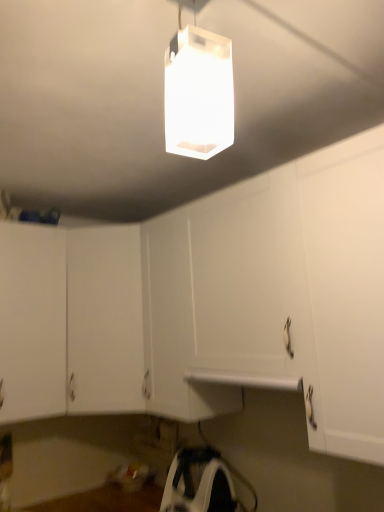
Question: Does white matte cabinet at center, which is the 1th cabinetry from right to left, have a smaller size compared to transparent plastic lamp at upper center?

Choices:
 (A) yes
 (B) no

Answer: (B)

Question: Are white matte cabinet at center, which is the 1th cabinetry from right to left, and transparent plastic lamp at upper center beside each other?

Choices:
 (A) no
 (B) yes

Answer: (A)

Question: Considering the relative positions of white matte cabinet at center, which appears as the second cabinetry when viewed from the left, and transparent plastic lamp at upper center in the image provided, is white matte cabinet at center, which appears as the second cabinetry when viewed from the left, to the left of transparent plastic lamp at upper center from the viewer's perspective?

Choices:
 (A) yes
 (B) no

Answer: (A)

Question: Is white matte cabinet at center, which appears as the second cabinetry when viewed from the left, surrounding transparent plastic lamp at upper center?

Choices:
 (A) yes
 (B) no

Answer: (B)

Question: Would you consider white matte cabinet at center, which is the 1th cabinetry from right to left, to be distant from transparent plastic lamp at upper center?

Choices:
 (A) yes
 (B) no

Answer: (A)

Question: Is point (59, 321) closer or farther from the camera than point (203, 44)?

Choices:
 (A) farther
 (B) closer

Answer: (A)

Question: In terms of width, does white matte cabinet at lower left, the 1th cabinetry viewed from the left, look wider or thinner when compared to transparent plastic lamp at upper center?

Choices:
 (A) thin
 (B) wide

Answer: (B)

Question: Is white matte cabinet at lower left, the 1th cabinetry viewed from the left, taller or shorter than transparent plastic lamp at upper center?

Choices:
 (A) short
 (B) tall

Answer: (B)

Question: Do you think white matte cabinet at lower left, the 2th cabinetry positioned from the right, is within transparent plastic lamp at upper center, or outside of it?

Choices:
 (A) inside
 (B) outside

Answer: (B)

Question: Is white matte cabinet at lower left, the 1th cabinetry viewed from the left, taller or shorter than white plastic iron at lower center?

Choices:
 (A) tall
 (B) short

Answer: (A)

Question: Does point click(13, 373) appear closer or farther from the camera than point click(203, 480)?

Choices:
 (A) closer
 (B) farther

Answer: (B)

Question: Looking at their shapes, would you say white matte cabinet at lower left, the 1th cabinetry viewed from the left, is wider or thinner than white plastic iron at lower center?

Choices:
 (A) wide
 (B) thin

Answer: (A)

Question: In the image, is white matte cabinet at lower left, the 2th cabinetry positioned from the right, on the left side or the right side of white plastic iron at lower center?

Choices:
 (A) right
 (B) left

Answer: (B)

Question: Based on their sizes in the image, would you say white plastic iron at lower center is bigger or smaller than transparent plastic lamp at upper center?

Choices:
 (A) small
 (B) big

Answer: (B)

Question: Is point [188, 471] closer or farther from the camera than point [205, 154]?

Choices:
 (A) closer
 (B) farther

Answer: (B)